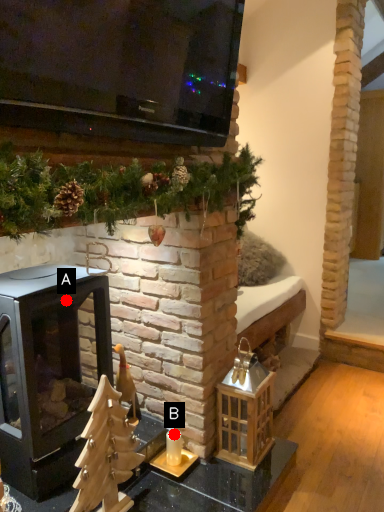
Question: Two points are circled on the image, labeled by A and B beside each circle. Which point is closer to the camera taking this photo?

Choices:
 (A) A is closer
 (B) B is closer

Answer: (A)